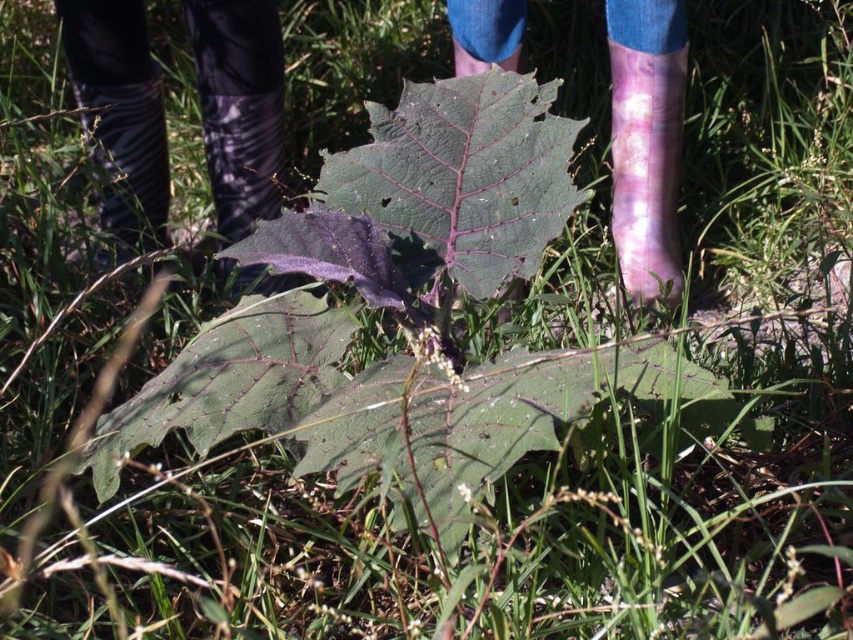
Question: Which is nearer to the purple matte leaf at center?

Choices:
 (A) matte black boot at center
 (B) purple matte boots at center

Answer: (A)

Question: Which object is closer to the camera taking this photo?

Choices:
 (A) zebra-patterned rubber boot at left
 (B) green matte leaf at center

Answer: (B)

Question: Can you confirm if purple rubber boot at center is wider than matte black boot at center?

Choices:
 (A) yes
 (B) no

Answer: (B)

Question: Which of the following is the farthest from the observer?

Choices:
 (A) (77, 0)
 (B) (553, 189)
 (C) (248, 161)
 (D) (157, 182)

Answer: (D)

Question: Can you confirm if purple matte boots at center is bigger than zebra-patterned rubber boot at left?

Choices:
 (A) no
 (B) yes

Answer: (B)

Question: Can you confirm if purple rubber boot at center is positioned below matte black boot at center?

Choices:
 (A) no
 (B) yes

Answer: (A)